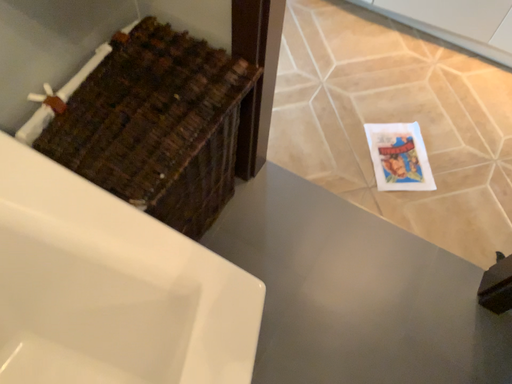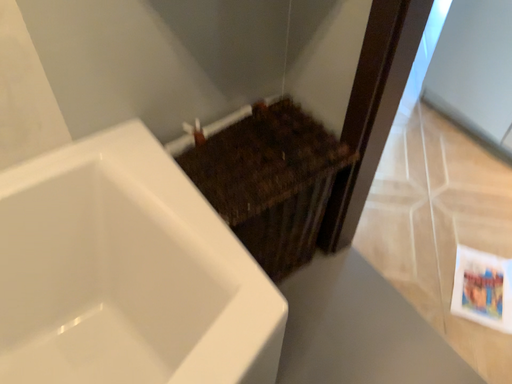
Question: Which way did the camera rotate in the video?

Choices:
 (A) rotated right
 (B) rotated left

Answer: (B)